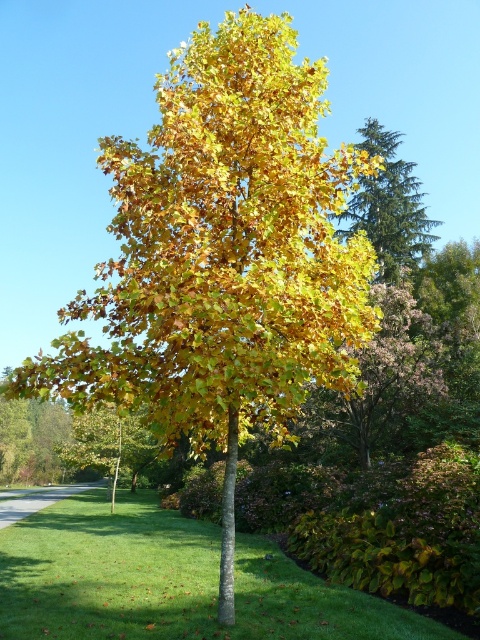
You are standing in the autumn scene and want to pick up the golden yellow leaves at upper right. Are they above or below the green grass at center?

The golden yellow leaves at upper right are above the green grass at center because the green grass at center is below them.

You are a gardener who wants to place a 10 meter long fence between the green grass at center and the golden yellow leaves at center. Will the fence be long enough to cover the space between them?

The distance between the green grass at center and the golden yellow leaves at center is 8.25 meters. Since the fence is 10 meters long, it will be long enough to cover the space between them.